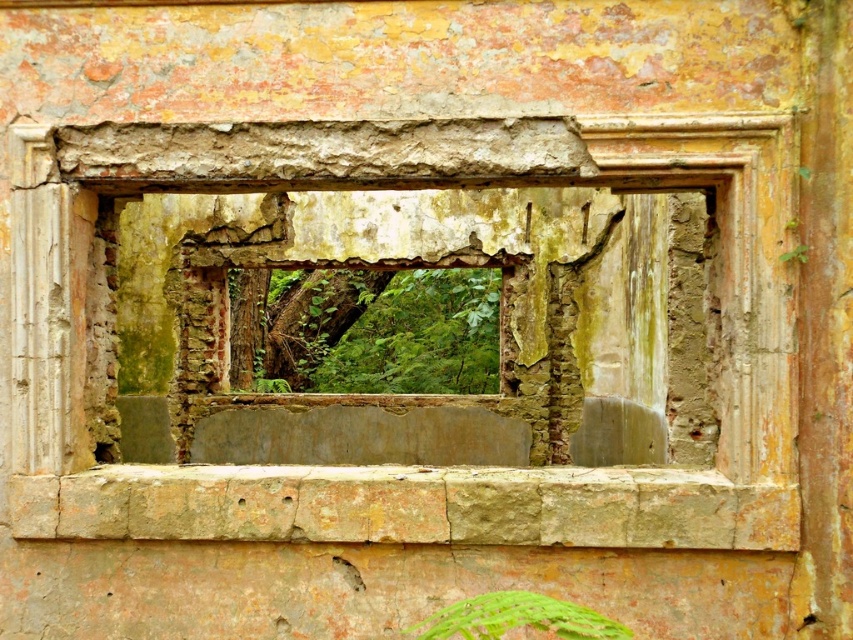
You are a painter assessing the damage to the rusty concrete window frame at center and the green leafy plant at lower center. Which object is wider?

The rusty concrete window frame at center is wider than the green leafy plant at lower center.

You are a maintenance worker inspecting the old building. You notice the rusty concrete window frame at center and the green leafy plant at lower center. Which object is positioned higher relative to the other?

The rusty concrete window frame at center is above the green leafy plant at lower center, so it is positioned higher.